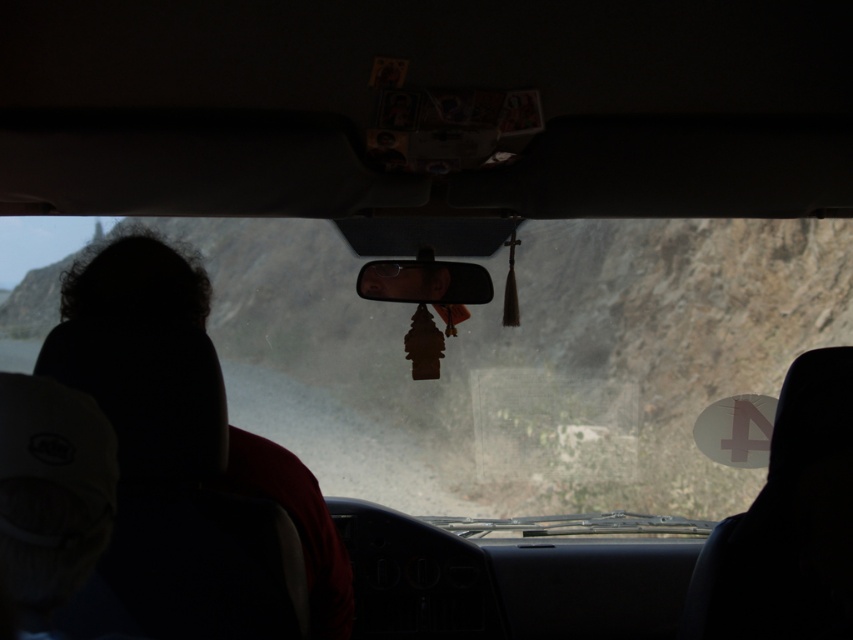
In the scene shown: Can you confirm if dark hair at left is positioned to the right of glossy plastic view mirror at center?

No, dark hair at left is not to the right of glossy plastic view mirror at center.

Is point (196, 346) more distant than point (474, 285)?

No.

Who is more forward, (212,358) or (436,266)?

Positioned in front is point (212,358).

This screenshot has height=640, width=853. I want to click on dark hair at left, so click(x=183, y=397).

Does transparent glass windshield at center have a lesser width compared to dark hair at left?

No, transparent glass windshield at center is not thinner than dark hair at left.

This screenshot has height=640, width=853. In order to click on transparent glass windshield at center in this screenshot , I will do `click(526, 360)`.

Which is more to the right, transparent glass windshield at center or glossy plastic view mirror at center?

Positioned to the right is transparent glass windshield at center.

Who is lower down, transparent glass windshield at center or glossy plastic view mirror at center?

transparent glass windshield at center is lower down.

What are the coordinates of `transparent glass windshield at center` in the screenshot? It's located at (526, 360).